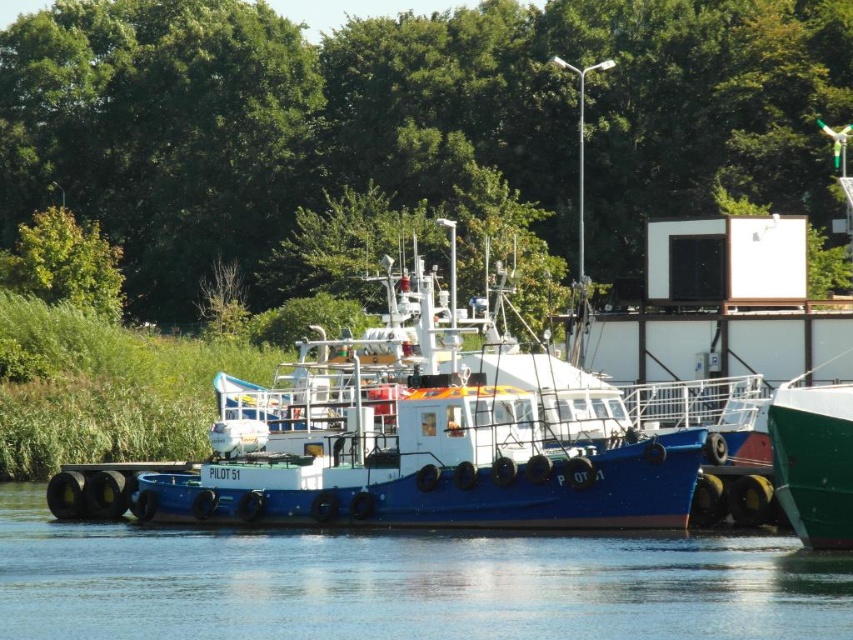
Question: Is blue matte tugboat at center in front of green leafy tree at upper left?

Choices:
 (A) yes
 (B) no

Answer: (A)

Question: Which object appears closest to the camera in this image?

Choices:
 (A) green leafy tree at upper left
 (B) blue matte tugboat at center
 (C) blue rubber tires at lower center
 (D) green leafy tree at upper center

Answer: (C)

Question: Is green leafy tree at upper center closer to camera compared to blue matte tugboat at center?

Choices:
 (A) yes
 (B) no

Answer: (B)

Question: Is blue matte tugboat at center bigger than green leafy tree at upper left?

Choices:
 (A) no
 (B) yes

Answer: (B)

Question: Which point is farther to the camera?

Choices:
 (A) (64, 474)
 (B) (746, 573)
 (C) (825, 150)
 (D) (86, 272)

Answer: (C)

Question: Among these points, which one is farthest from the camera?

Choices:
 (A) (3, 109)
 (B) (73, 244)

Answer: (A)